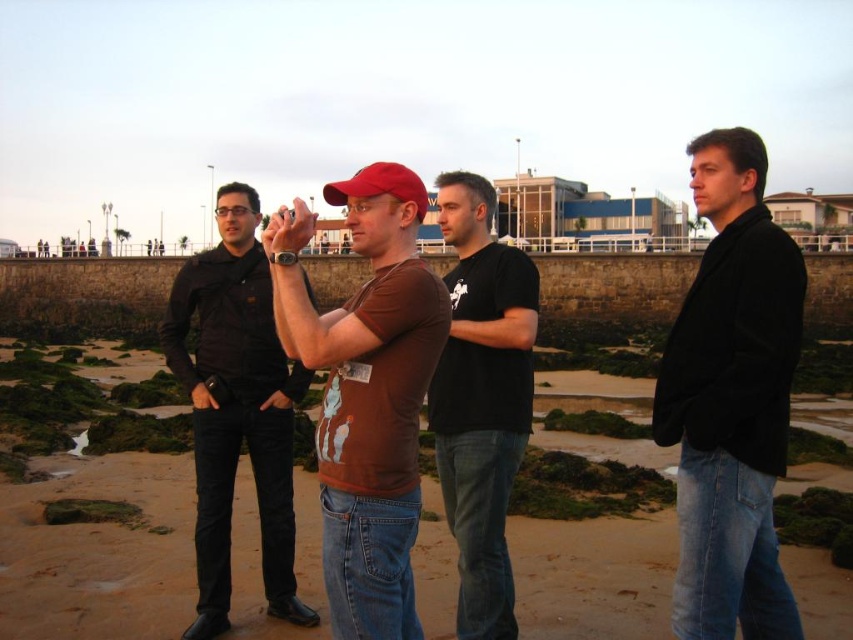
You are standing at the point marked as point (677,492) in the image. You want to take a photo of the man holding a camera. Is the man holding the camera within your 50 meter visibility range?

The distance between point (677,492) and the camera is 35.19 meters, which is within the 50 meter visibility range. Therefore, the man holding the camera is visible from your current position.